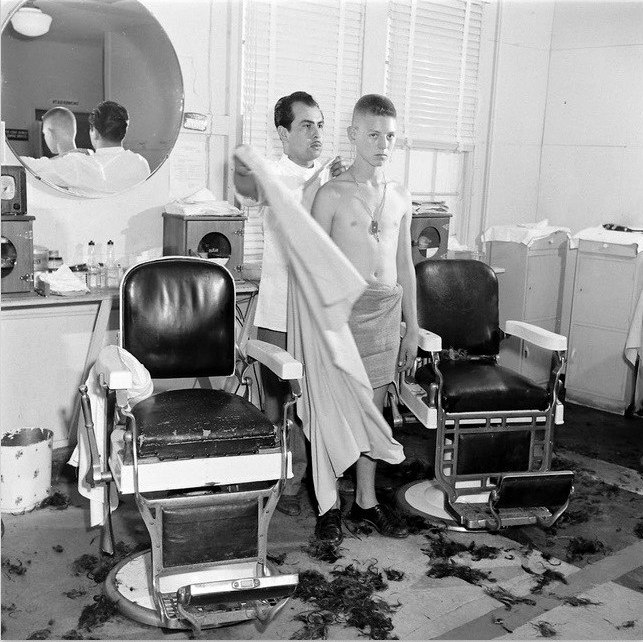
What are the coordinates of `towel` in the screenshot? It's located at (374, 324).